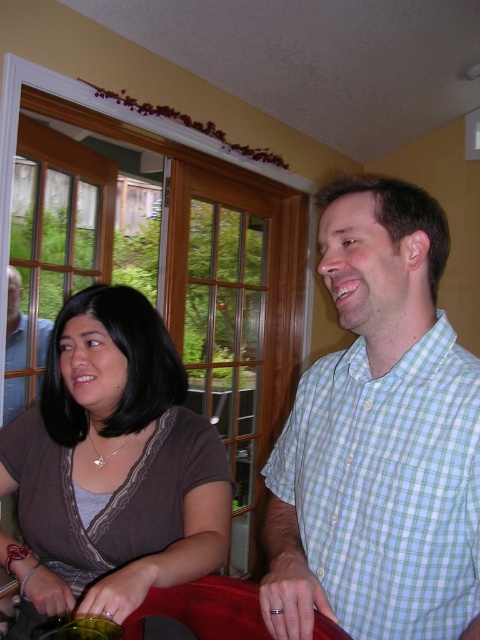
Question: Which object appears farthest from the camera in this image?

Choices:
 (A) matte black laptop at left
 (B) green checkered shirt at upper right
 (C) matte brown blouse at center
 (D) green checkered shirt at center

Answer: (A)

Question: Can you confirm if matte brown blouse at center is bigger than matte black laptop at left?

Choices:
 (A) yes
 (B) no

Answer: (A)

Question: Is the position of green checkered shirt at center more distant than that of matte black laptop at left?

Choices:
 (A) yes
 (B) no

Answer: (B)

Question: Which object is closer to the camera taking this photo?

Choices:
 (A) green checkered shirt at upper right
 (B) matte black laptop at left

Answer: (A)

Question: Is green checkered shirt at center bigger than green checkered shirt at upper right?

Choices:
 (A) no
 (B) yes

Answer: (B)

Question: Which object is closer to the camera taking this photo?

Choices:
 (A) matte brown blouse at center
 (B) green checkered shirt at center

Answer: (B)